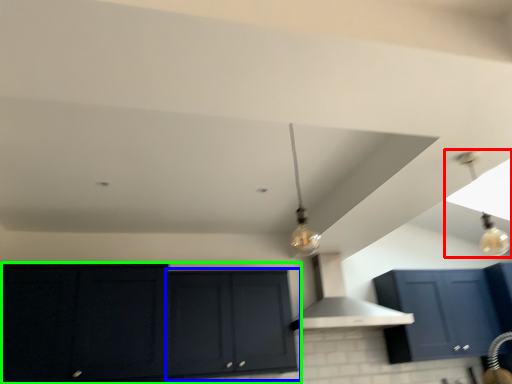
Question: Considering the real-world distances, which object is closest to light fixture (highlighted by a red box)? cabinetry (highlighted by a blue box) or cabinetry (highlighted by a green box).

Choices:
 (A) cabinetry
 (B) cabinetry

Answer: (A)